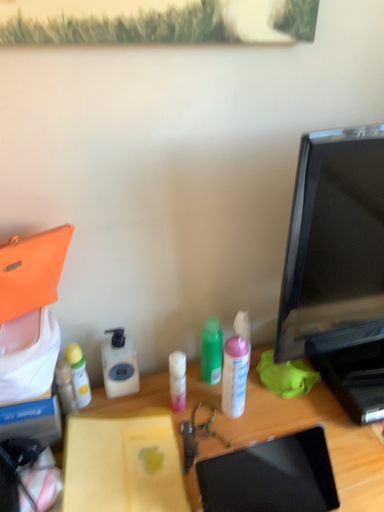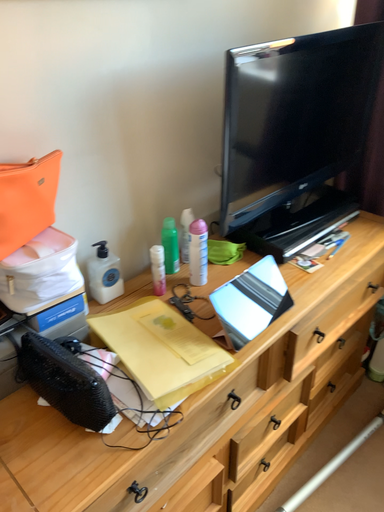
Question: How did the camera likely rotate when shooting the video?

Choices:
 (A) rotated right
 (B) rotated left

Answer: (A)